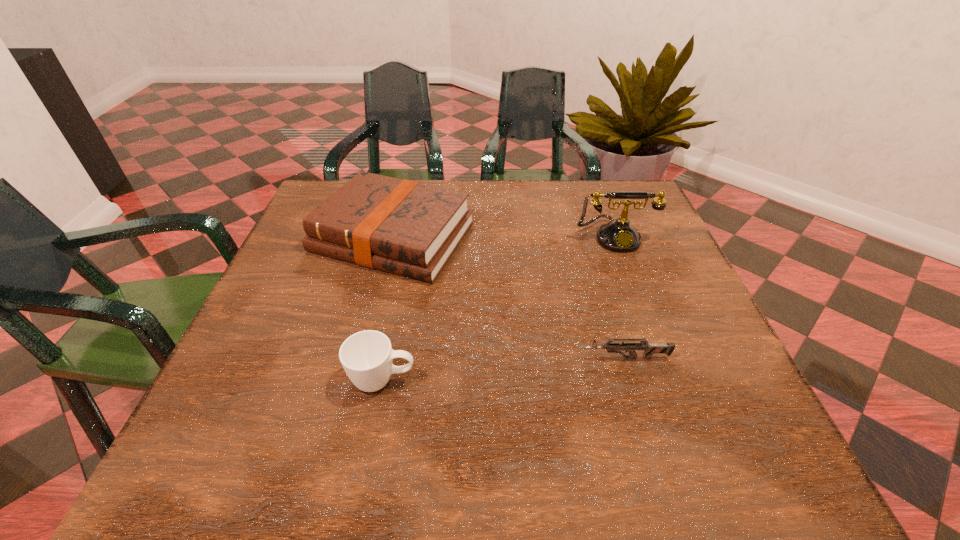
At what (x,y) coordinates should I click in order to perform the action: click on vacant area that lies between the hardback book and the nearest object. Please return your answer as a coordinate pair (x, y). Looking at the image, I should click on (388, 308).

Locate an element on the screen. This screenshot has height=540, width=960. blank region between the nearest object and the tallest object is located at coordinates (498, 308).

At what (x,y) coordinates should I click in order to perform the action: click on vacant area between the third farthest object and the hardback book. Please return your answer as a coordinate pair (x, y). This screenshot has width=960, height=540. Looking at the image, I should click on (509, 298).

Locate an element on the screen. The image size is (960, 540). free space between the cup and the second nearest object is located at coordinates (503, 369).

Find the location of a particular element. The height and width of the screenshot is (540, 960). vacant space in between the tallest object and the hardback book is located at coordinates (504, 237).

Identify which object is the nearest to the tallest object. Please provide its 2D coordinates. Your answer should be formatted as a tuple, i.e. [(x, y)], where the tuple contains the x and y coordinates of a point satisfying the conditions above.

[(404, 227)]

Locate which object ranks in proximity to the hardback book. Please provide its 2D coordinates. Your answer should be formatted as a tuple, i.e. [(x, y)], where the tuple contains the x and y coordinates of a point satisfying the conditions above.

[(366, 356)]

Locate an element on the screen. vacant space that satisfies the following two spatial constraints: 1. on the dial of the telephone; 2. with the handle on the side of the nearest object is located at coordinates (668, 380).

Identify the location of vacant space that satisfies the following two spatial constraints: 1. on the dial of the tallest object; 2. with the handle on the side of the cup. The image size is (960, 540). (668, 380).

This screenshot has height=540, width=960. What are the coordinates of `vacant position in the image that satisfies the following two spatial constraints: 1. on the dial of the telephone; 2. aimed along the barrel of the shortest object` in the screenshot? It's located at (660, 358).